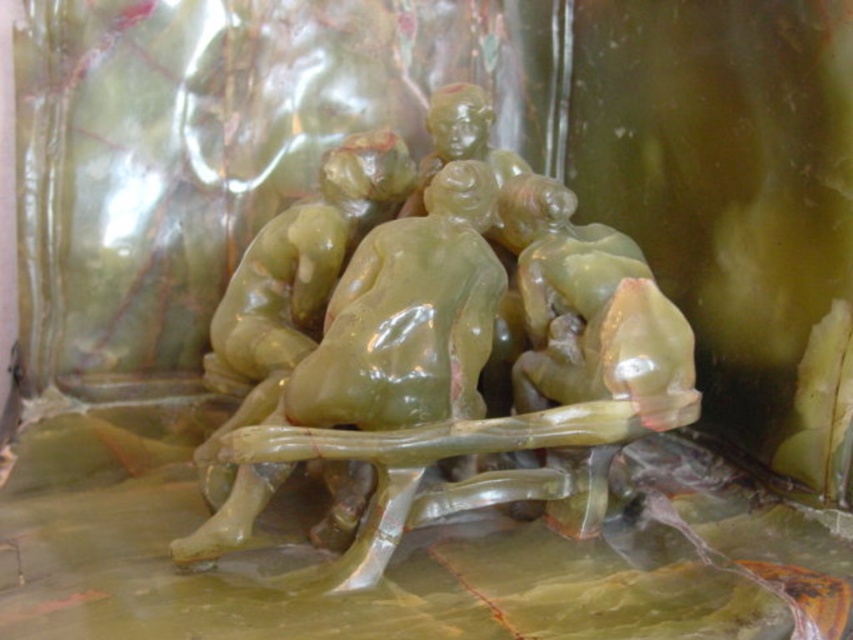
Between point (550, 483) and point (268, 291), which one is positioned behind?

Point (268, 291)

Does point (386, 324) come closer to viewer compared to point (274, 276)?

Yes.

Locate an element on the screen. green translucent statue at center is located at coordinates (450, 358).